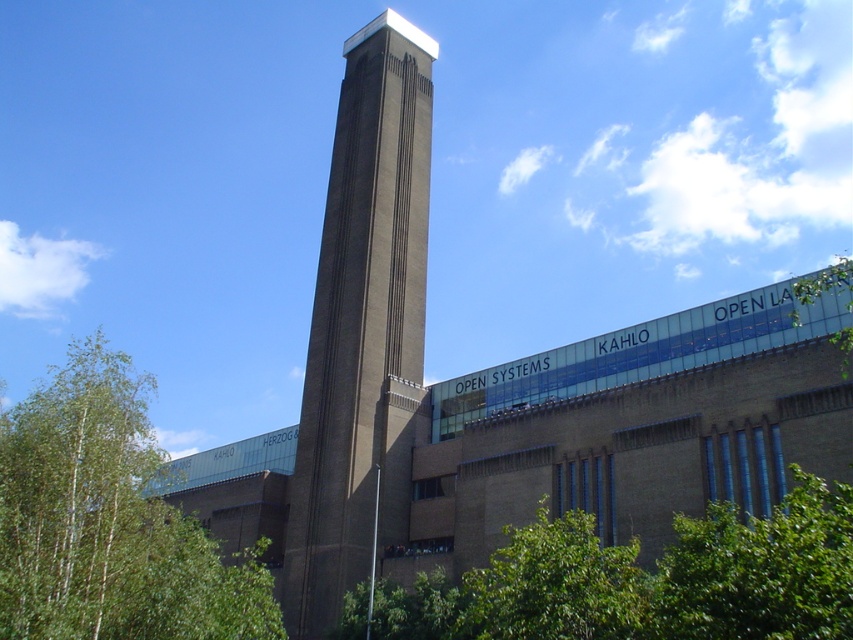
Who is positioned more to the left, green leafy tree at lower left or green leafy tree at lower right?

From the viewer's perspective, green leafy tree at lower left appears more on the left side.

Who is lower down, green leafy tree at lower left or green leafy tree at lower right?

green leafy tree at lower left is lower down.

Between point (90, 451) and point (415, 598), which one is positioned in front?

Point (90, 451) is in front.

Locate an element on the screen. The width and height of the screenshot is (853, 640). green leafy tree at lower left is located at coordinates (109, 522).

Consider the image. Between brown brick tower at center and green leafy tree at upper right, which one appears on the left side from the viewer's perspective?

brown brick tower at center

Is brown brick tower at center in front of green leafy tree at upper right?

No, it is behind green leafy tree at upper right.

Identify the location of brown brick tower at center. (363, 326).

Identify the location of brown brick tower at center. This screenshot has width=853, height=640. (363, 326).

Can you confirm if brown brick tower at center is shorter than green leafy tree at lower right?

No.

Find the location of `brown brick tower at center`. brown brick tower at center is located at coordinates (363, 326).